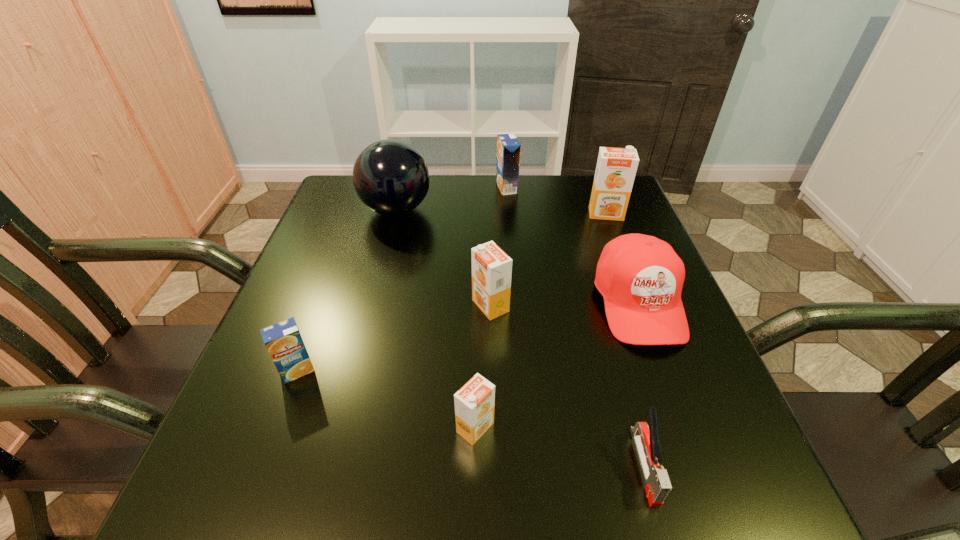
This screenshot has width=960, height=540. I want to click on the nearest orange juice, so click(474, 403).

Locate an element on the screen. the smallest orange orange juice is located at coordinates [x=474, y=403].

I want to click on stapler, so click(647, 443).

This screenshot has height=540, width=960. I want to click on vacant space located on the side of the black bowling ball with the finger holes, so click(496, 210).

Identify the location of free space located 0.150m on the front of the rightmost orange juice. (623, 259).

Identify the location of vacant space located 0.270m on the back of the second biggest orange orange juice. (489, 219).

What are the coordinates of `free space located on the left of the farthest orange juice` in the screenshot? It's located at (475, 188).

The height and width of the screenshot is (540, 960). Identify the location of vacant area situated 0.180m on the front panel of the baseball cap. (692, 446).

Where is `vacant position located 0.180m on the back of the sixth farthest object`? The height and width of the screenshot is (540, 960). vacant position located 0.180m on the back of the sixth farthest object is located at coordinates (327, 289).

The width and height of the screenshot is (960, 540). I want to click on vacant region located on the back of the nearest orange juice, so click(475, 384).